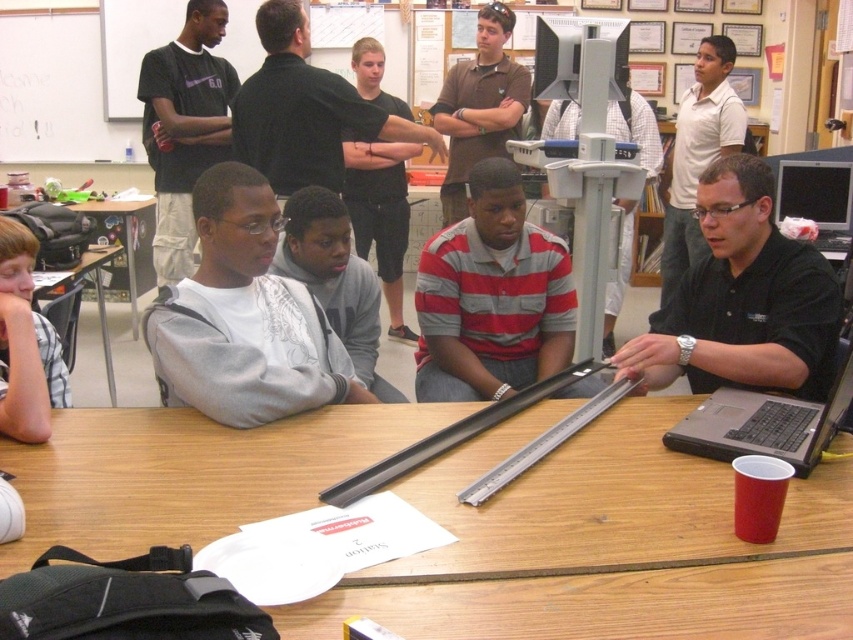
Can you confirm if wooden table at center is positioned to the right of dark gray shirt at center?

Indeed, wooden table at center is positioned on the right side of dark gray shirt at center.

Who is lower down, wooden table at center or dark gray shirt at center?

wooden table at center

Between point (218, 516) and point (387, 332), which one is positioned behind?

The point (387, 332) is behind.

You are a GUI agent. You are given a task and a screenshot of the screen. Output one action in this format:
    pyautogui.click(x=<x>, y=<y>)
    Task: Click on the wooden table at center
    The height and width of the screenshot is (640, 853).
    Given the screenshot: What is the action you would take?
    pyautogui.click(x=602, y=545)

The height and width of the screenshot is (640, 853). I want to click on striped cotton shirt at center, so click(x=492, y=296).

Can you confirm if striped cotton shirt at center is positioned to the left of matte black laptop at right?

Correct, you'll find striped cotton shirt at center to the left of matte black laptop at right.

Who is more forward, (503, 284) or (811, 416)?

Point (811, 416) is more forward.

Identify the location of striped cotton shirt at center. (492, 296).

What do you see at coordinates (602, 545) in the screenshot? I see `wooden table at center` at bounding box center [602, 545].

At what (x,y) coordinates should I click in order to perform the action: click on wooden table at center. Please return your answer as a coordinate pair (x, y). The image size is (853, 640). Looking at the image, I should click on (602, 545).